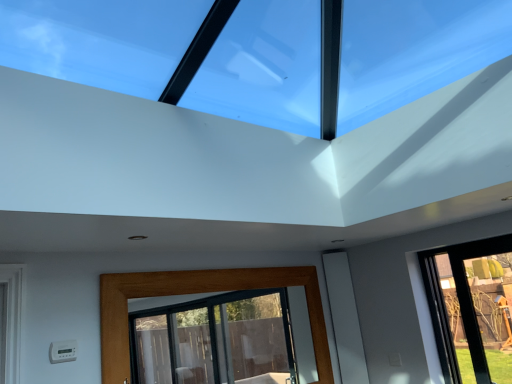
Question: Looking at their shapes, would you say transparent glass window at upper center, placed as the 1th window when sorted from top to bottom, is wider or thinner than wooden-framed glass door at lower center, which is counted as the second window, starting from the top?

Choices:
 (A) thin
 (B) wide

Answer: (B)

Question: In terms of height, does transparent glass window at upper center, which ranks as the second window in bottom-to-top order, look taller or shorter compared to wooden-framed glass door at lower center, which is counted as the second window, starting from the top?

Choices:
 (A) tall
 (B) short

Answer: (B)

Question: From the image's perspective, relative to wooden-framed glass door at lower center, which is counted as the second window, starting from the top, is transparent glass window at upper center, which ranks as the second window in bottom-to-top order, above or below?

Choices:
 (A) below
 (B) above

Answer: (B)

Question: From the image's perspective, is wooden-framed glass door at lower center, marked as the 1th window in a bottom-to-top arrangement, above or below transparent glass window at upper center, which ranks as the second window in bottom-to-top order?

Choices:
 (A) below
 (B) above

Answer: (A)

Question: Is wooden-framed glass door at lower center, marked as the 1th window in a bottom-to-top arrangement, inside or outside of transparent glass window at upper center, placed as the 1th window when sorted from top to bottom?

Choices:
 (A) inside
 (B) outside

Answer: (B)

Question: Considering the relative positions of wooden-framed glass door at lower center, marked as the 1th window in a bottom-to-top arrangement, and transparent glass window at upper center, placed as the 1th window when sorted from top to bottom, in the image provided, is wooden-framed glass door at lower center, marked as the 1th window in a bottom-to-top arrangement, to the left or to the right of transparent glass window at upper center, placed as the 1th window when sorted from top to bottom,?

Choices:
 (A) right
 (B) left

Answer: (B)

Question: Relative to transparent glass window at upper center, placed as the 1th window when sorted from top to bottom, is wooden-framed glass door at lower center, marked as the 1th window in a bottom-to-top arrangement, in front or behind?

Choices:
 (A) behind
 (B) front

Answer: (A)